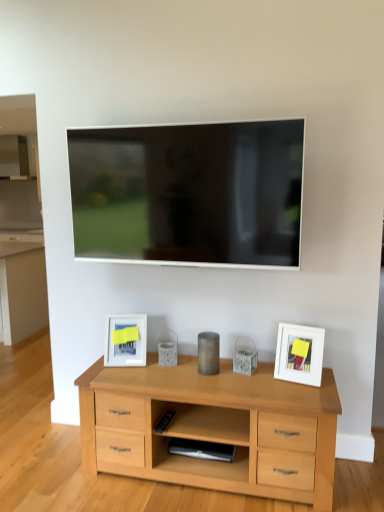
Question: From a real-world perspective, does metallic cylinder at center, marked as the second appliance in a bottom-to-top arrangement, stand above satin black speaker at lower center, the 2th appliance from the top?

Choices:
 (A) yes
 (B) no

Answer: (A)

Question: From the image's perspective, would you say metallic cylinder at center, the first appliance from the top, is positioned over satin black speaker at lower center, the 2th appliance from the top?

Choices:
 (A) no
 (B) yes

Answer: (B)

Question: Is metallic cylinder at center, the first appliance from the top, smaller than satin black speaker at lower center, the 1th appliance when ordered from bottom to top?

Choices:
 (A) no
 (B) yes

Answer: (B)

Question: Are metallic cylinder at center, the first appliance from the top, and satin black speaker at lower center, the 2th appliance from the top, located far from each other?

Choices:
 (A) no
 (B) yes

Answer: (A)

Question: From a real-world perspective, is metallic cylinder at center, the first appliance from the top, under satin black speaker at lower center, the 1th appliance when ordered from bottom to top?

Choices:
 (A) yes
 (B) no

Answer: (B)

Question: Is white matte picture frame at right, the second picture frame viewed from the left, in front of or behind satin black speaker at lower center, the 1th appliance when ordered from bottom to top, in the image?

Choices:
 (A) behind
 (B) front

Answer: (B)

Question: Considering the positions of white matte picture frame at right, the second picture frame when ordered from back to front, and satin black speaker at lower center, the 2th appliance from the top, in the image, is white matte picture frame at right, the second picture frame when ordered from back to front, wider or thinner than satin black speaker at lower center, the 2th appliance from the top,?

Choices:
 (A) wide
 (B) thin

Answer: (B)

Question: In terms of size, does white matte picture frame at right, marked as the first picture frame in a front-to-back arrangement, appear bigger or smaller than satin black speaker at lower center, the 1th appliance when ordered from bottom to top?

Choices:
 (A) small
 (B) big

Answer: (B)

Question: Visually, is white matte picture frame at right, the second picture frame viewed from the left, positioned to the left or to the right of satin black speaker at lower center, the 1th appliance when ordered from bottom to top?

Choices:
 (A) left
 (B) right

Answer: (B)

Question: Relative to white matte picture frame at lower left, which appears as the first picture frame when viewed from the back, is satin black speaker at lower center, the 1th appliance when ordered from bottom to top, in front or behind?

Choices:
 (A) behind
 (B) front

Answer: (B)

Question: Is satin black speaker at lower center, the 1th appliance when ordered from bottom to top, to the left or to the right of white matte picture frame at lower left, which appears as the first picture frame when viewed from the back, in the image?

Choices:
 (A) right
 (B) left

Answer: (A)

Question: Looking at their shapes, would you say satin black speaker at lower center, the 2th appliance from the top, is wider or thinner than white matte picture frame at lower left, which appears as the first picture frame when viewed from the back?

Choices:
 (A) wide
 (B) thin

Answer: (A)

Question: Would you say satin black speaker at lower center, the 2th appliance from the top, is inside or outside white matte picture frame at lower left, which ranks as the 1th picture frame in left-to-right order?

Choices:
 (A) outside
 (B) inside

Answer: (A)

Question: Is white matte picture frame at lower left, the 2th picture frame in the right-to-left sequence, taller or shorter than matte black tv at upper center?

Choices:
 (A) tall
 (B) short

Answer: (B)

Question: In terms of width, does white matte picture frame at lower left, which ranks as the 1th picture frame in left-to-right order, look wider or thinner when compared to matte black tv at upper center?

Choices:
 (A) wide
 (B) thin

Answer: (A)